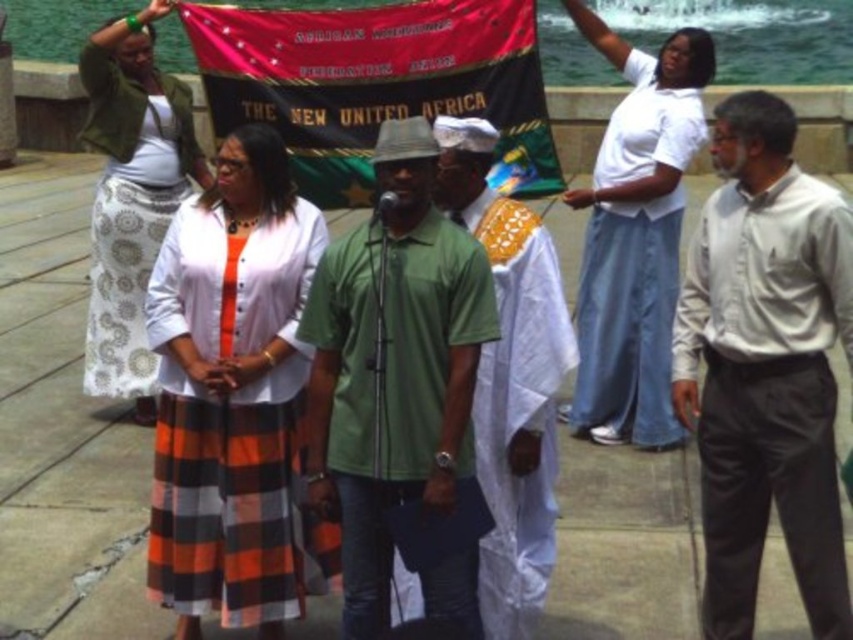
You are standing at the origin point of the coordinate system. There is an orange plaid skirt at center located at point (231, 392). If you move 0.1 units to the right, will you be closer to or farther from the orange plaid skirt at center?

Moving 0.1 units to the right from the origin would increase your x coordinate from 0 to 0.1. The orange plaid skirt at center is at x coordinate 0.614, so moving right reduces the distance between you and the skirt. Therefore, you would be closer to the orange plaid skirt at center.

You are attending an outdoor event near water and see two skirts in the crowd. The orange plaid skirt at center and the white cotton skirt at upper left. Which skirt is located more to the right side of the other?

The orange plaid skirt at center is positioned on the right side of white cotton skirt at upper left.

You are a photographer trying to capture the orange plaid skirt at center and the green matte shirt at center in the same frame. Based on their positions, which one will appear taller in the photo?

The orange plaid skirt at center appears taller than the green matte shirt at center in the photo.